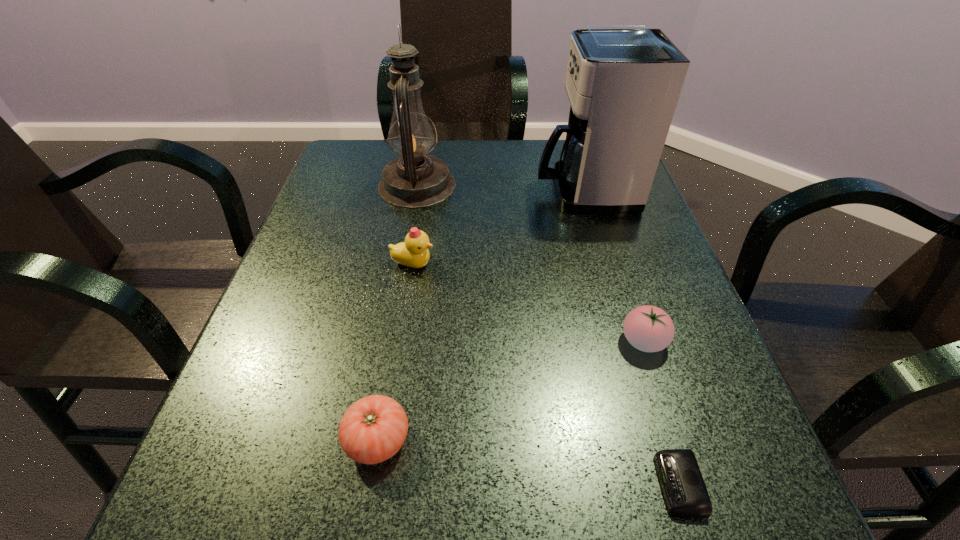
Find the location of a particular element. Image resolution: width=960 pixels, height=540 pixels. vacant space located 0.200m on the front panel of the coffee maker is located at coordinates (454, 191).

Where is `free location located on the front panel of the coffee maker`? free location located on the front panel of the coffee maker is located at coordinates (462, 191).

The width and height of the screenshot is (960, 540). In order to click on vacant area located on the front-facing side of the fourth shortest object in this screenshot , I will do `click(486, 265)`.

You are a GUI agent. You are given a task and a screenshot of the screen. Output one action in this format:
    pyautogui.click(x=<x>, y=<y>)
    Task: Click on the free spot located 0.270m on the left of the fourth farthest object
    
    Given the screenshot: What is the action you would take?
    pyautogui.click(x=461, y=341)

This screenshot has width=960, height=540. What are the coordinates of `vacant area located 0.160m on the back of the left tomato` in the screenshot? It's located at (396, 326).

Where is `blank space located 0.060m on the display of the shortest object`? Image resolution: width=960 pixels, height=540 pixels. blank space located 0.060m on the display of the shortest object is located at coordinates (614, 484).

Image resolution: width=960 pixels, height=540 pixels. Find the location of `blank space located 0.120m on the display of the shortest object`. blank space located 0.120m on the display of the shortest object is located at coordinates (568, 484).

At what (x,y) coordinates should I click in order to perform the action: click on vacant area situated 0.130m on the display of the shortest object. Please return your answer as a coordinate pair (x, y). Looking at the image, I should click on (561, 484).

Find the location of `oil lamp at the far edge`. oil lamp at the far edge is located at coordinates (416, 180).

What are the coordinates of `coffee maker that is positioned at the far edge` in the screenshot? It's located at (623, 82).